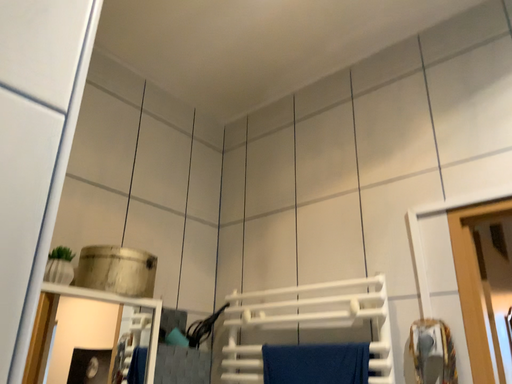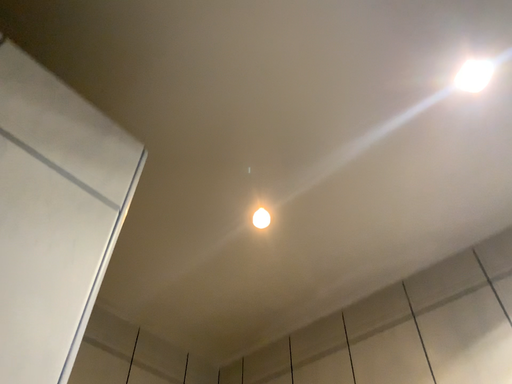
Question: How did the camera likely rotate when shooting the video?

Choices:
 (A) rotated downward
 (B) rotated upward

Answer: (B)